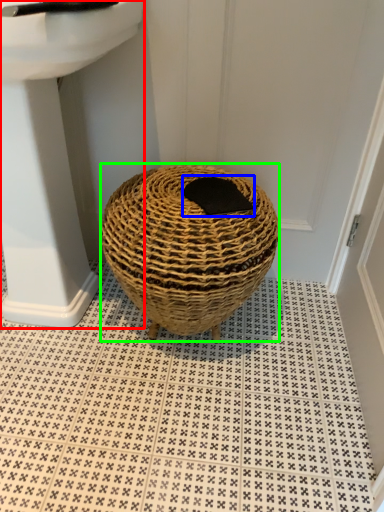
Question: Which is nearer to the sink (highlighted by a red box)? pad (highlighted by a blue box) or basket (highlighted by a green box).

Choices:
 (A) pad
 (B) basket

Answer: (B)